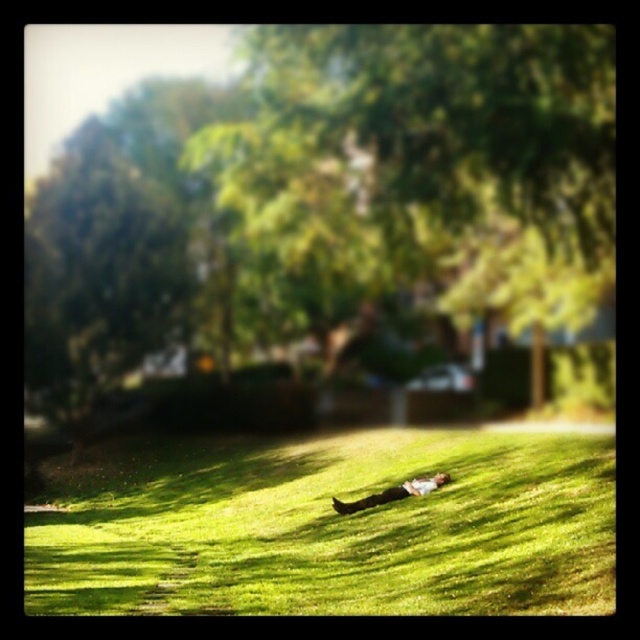
You are standing in the middle of the lawn and see two points marked in the image. Which point is closer to you, point (429, 259) or point (349, 506)?

Point (429, 259) is closer to you because it is further to the viewer than point (349, 506).

You are standing at the edge of the lawn and see the green grass at lower center and the light brown leather jacket at center. Which object is closer to you?

The green grass at lower center is closer to you because it is in front of the light brown leather jacket at center.

You are a photographer trying to capture a wide shot of the scene. You want to ensure that both the green grass at lower center and the light brown leather jacket at center are clearly visible. Based on their sizes, which object should you focus on to ensure both are in frame?

The green grass at lower center is wider than the light brown leather jacket at center. To ensure both are in frame, focus on the larger green grass at lower center as it occupies more space, allowing the jacket to be captured alongside.